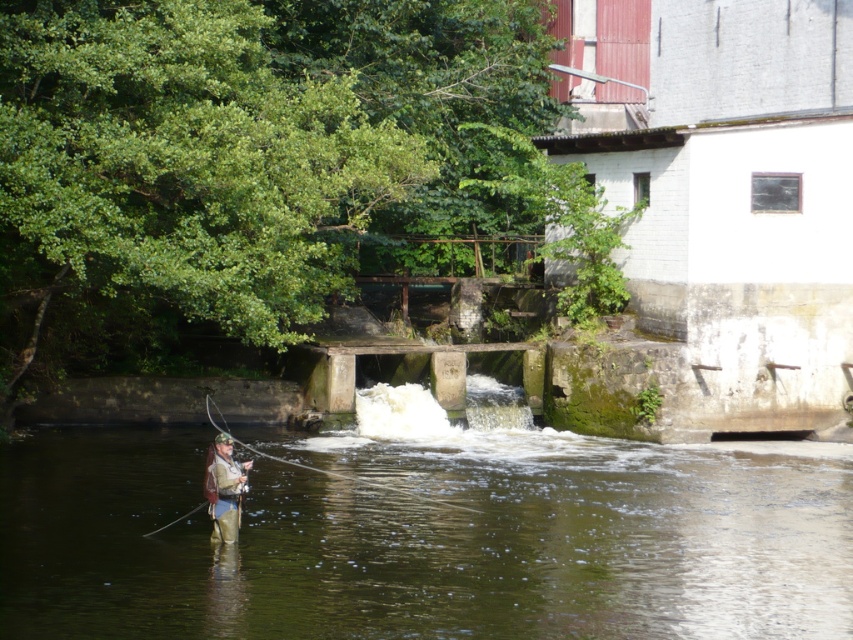
Question: Among these points, which one is nearest to the camera?

Choices:
 (A) (436, 552)
 (B) (221, 451)

Answer: (A)

Question: Is green mossy stone at center further to the viewer compared to camouflage jacket at center?

Choices:
 (A) no
 (B) yes

Answer: (A)

Question: Which point appears farthest from the camera in this image?

Choices:
 (A) (399, 621)
 (B) (231, 492)

Answer: (B)

Question: From the image, what is the correct spatial relationship of green mossy stone at center in relation to camouflage jacket at center?

Choices:
 (A) left
 (B) right

Answer: (B)

Question: Can you confirm if green mossy stone at center is positioned below camouflage jacket at center?

Choices:
 (A) yes
 (B) no

Answer: (A)

Question: Which of the following is the farthest from the observer?

Choices:
 (A) (231, 512)
 (B) (757, 552)

Answer: (B)